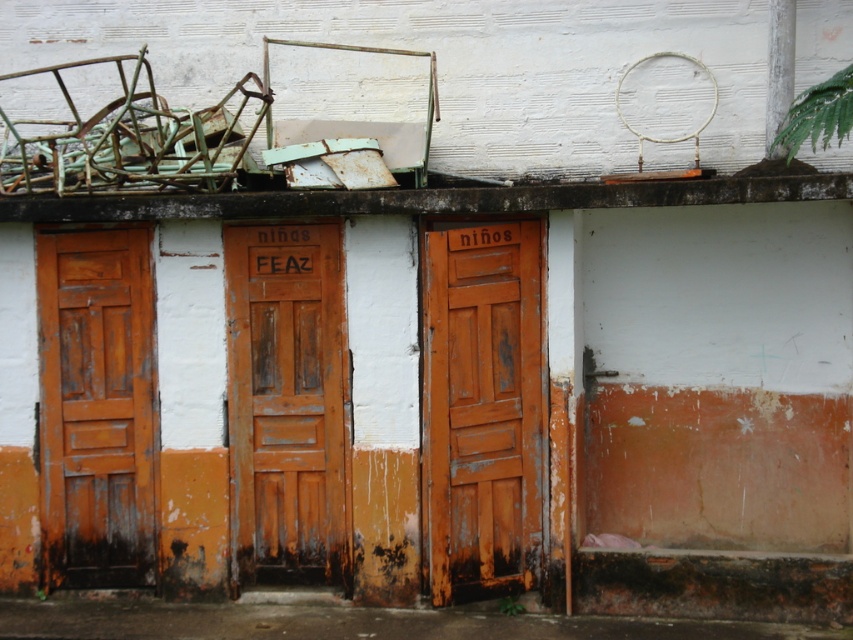
Question: Is wooden door at center bigger than rusty wood door at left?

Choices:
 (A) no
 (B) yes

Answer: (B)

Question: Can you confirm if rusty wood door at center is thinner than rusty wood door at left?

Choices:
 (A) no
 (B) yes

Answer: (A)

Question: Which point appears closest to the camera in this image?

Choices:
 (A) (439, 420)
 (B) (50, 579)

Answer: (A)

Question: Which object is farther from the camera taking this photo?

Choices:
 (A) wooden door at center
 (B) rusty wood door at left
 (C) rusty wood door at center

Answer: (B)

Question: Based on their relative distances, which object is farther from the wooden door at center?

Choices:
 (A) rusty wood door at center
 (B) rusty wood door at left

Answer: (B)

Question: Does rusty wood door at center have a smaller size compared to rusty wood door at left?

Choices:
 (A) no
 (B) yes

Answer: (A)